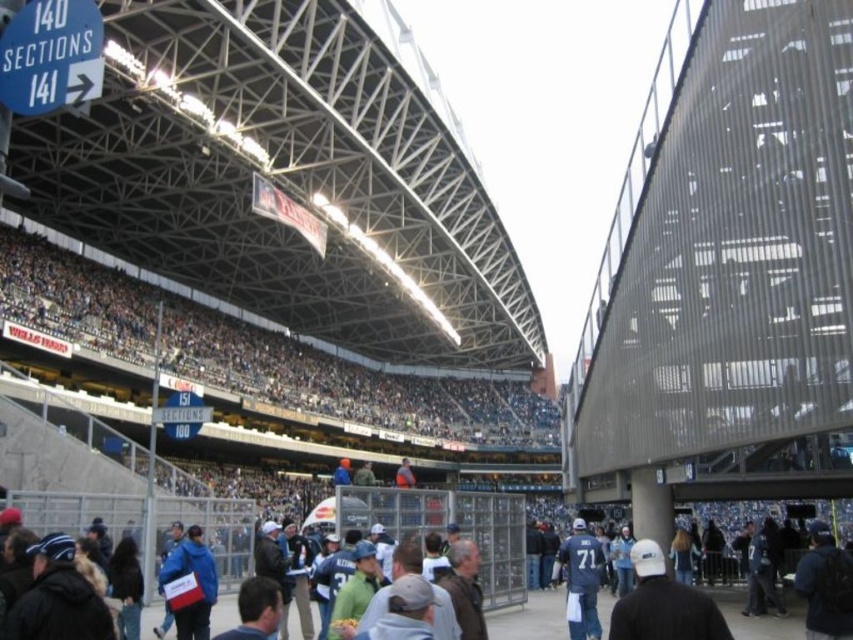
You are a photographer at the stadium and want to capture both the blue fabric jacket at lower left and the blue jersey at center in a single shot. Which clothing item will appear smaller in the photo?

The blue fabric jacket at lower left will appear smaller in the photo because it has a lesser width compared to the blue jersey at center.